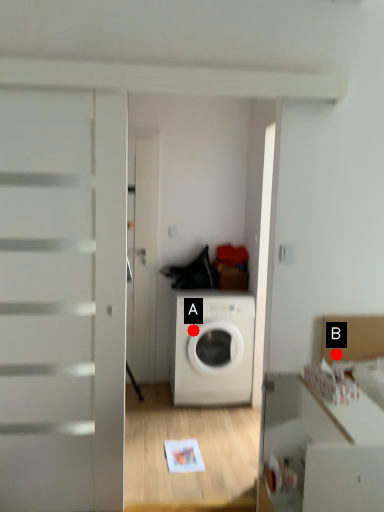
Question: Two points are circled on the image, labeled by A and B beside each circle. Which of the following is the farthest from the observer?

Choices:
 (A) A is further
 (B) B is further

Answer: (A)